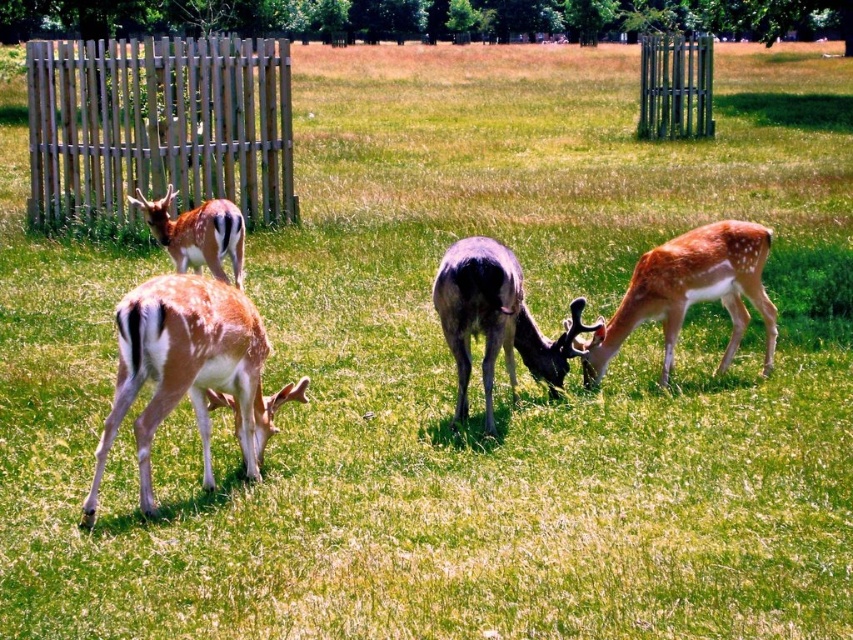
Is wooden fence at left behind fawn fur deer at left?

Yes, it is behind fawn fur deer at left.

Is point (154, 102) more distant than point (183, 236)?

Yes, it is.

Between point (218, 61) and point (225, 252), which one is positioned in front?

Point (225, 252) is in front.

At what (x,y) coordinates should I click in order to perform the action: click on wooden fence at left. Please return your answer as a coordinate pair (x, y). Looking at the image, I should click on (160, 124).

Does wooden fence at left have a lesser width compared to green wooden fence at upper right?

Correct, wooden fence at left's width is less than green wooden fence at upper right's.

Is wooden fence at left below green wooden fence at upper right?

Yes.

The width and height of the screenshot is (853, 640). I want to click on wooden fence at left, so click(x=160, y=124).

Where is `fawn fur deer at lower left`? This screenshot has width=853, height=640. fawn fur deer at lower left is located at coordinates (189, 371).

Identify the location of fawn fur deer at lower left. The image size is (853, 640). (189, 371).

I want to click on fawn fur deer at lower left, so click(189, 371).